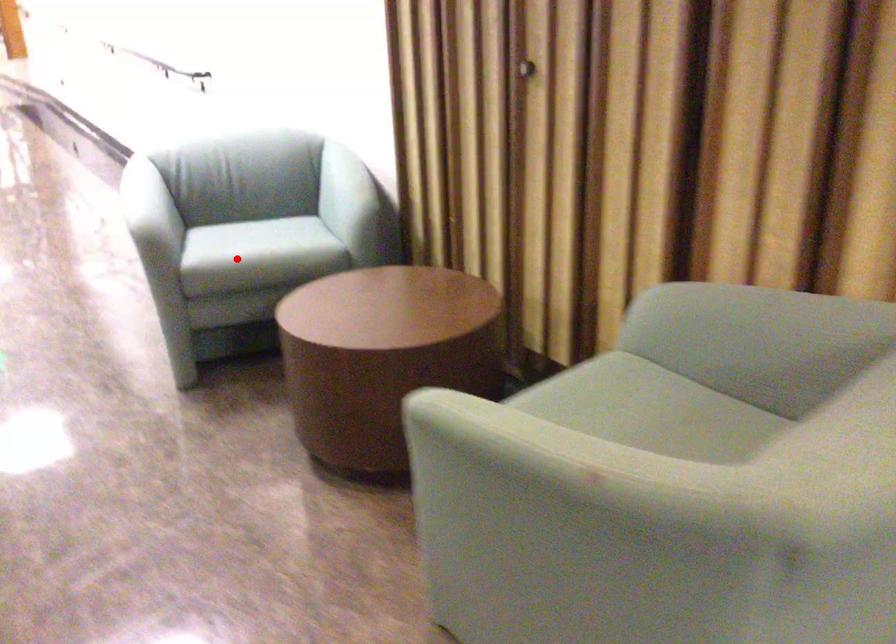
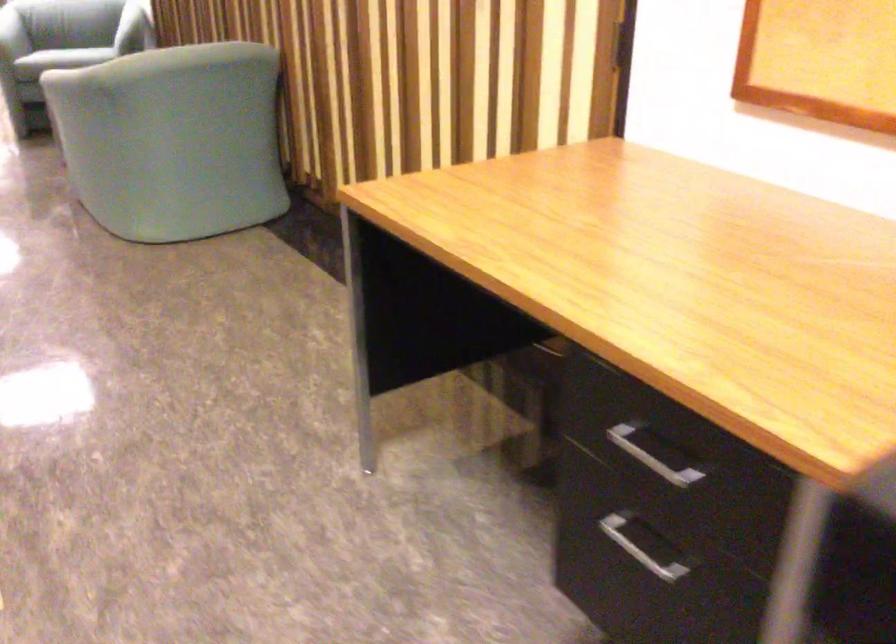
Question: I am providing you with two images of the same scene from different viewpoints. Given a red point in image1, look at the same physical point in image2. Is it:

Choices:
 (A) Closer to the viewpoint
 (B) Farther from the viewpoint

Answer: (B)